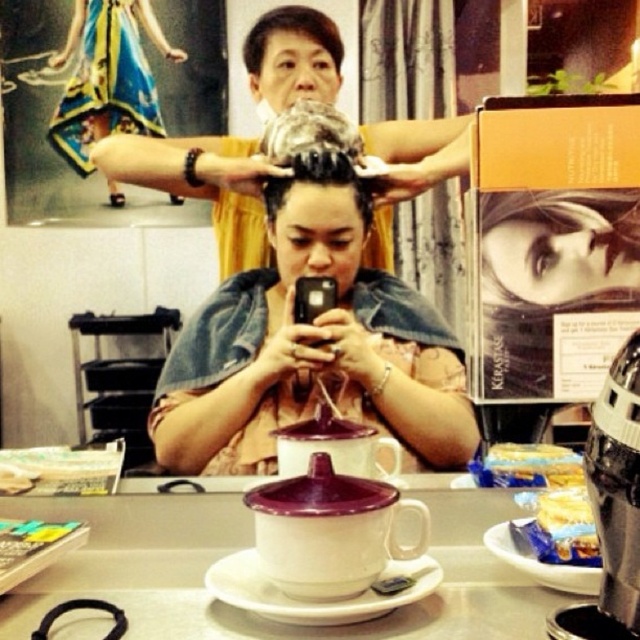
Question: Can you confirm if matte black phone at center is positioned below metallic silver coffee machine at lower right?

Choices:
 (A) no
 (B) yes

Answer: (A)

Question: Does metallic silver coffee machine at lower right appear under short hair at upper center?

Choices:
 (A) yes
 (B) no

Answer: (A)

Question: Does denim jacket at center have a smaller size compared to metallic silver coffee machine at lower right?

Choices:
 (A) yes
 (B) no

Answer: (B)

Question: Among these points, which one is nearest to the camera?

Choices:
 (A) (266, 35)
 (B) (637, 630)
 (C) (259, 243)
 (D) (291, 244)

Answer: (B)

Question: Estimate the real-world distances between objects in this image. Which object is farther from the metallic silver coffee machine at lower right?

Choices:
 (A) short hair at upper center
 (B) matte black phone at center

Answer: (A)

Question: Which point appears farthest from the camera in this image?

Choices:
 (A) (260, 20)
 (B) (600, 419)

Answer: (A)